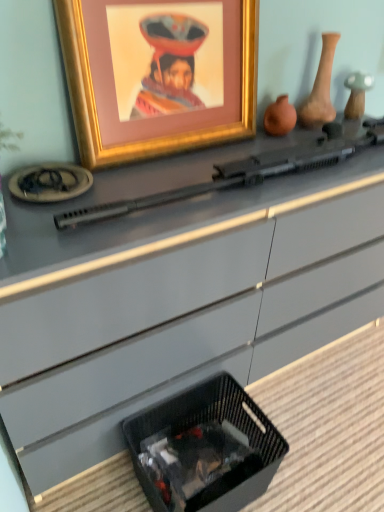
What are the coordinates of `vacant space underneath black plastic rifle at center (from a real-world perspective)` in the screenshot? It's located at (254, 178).